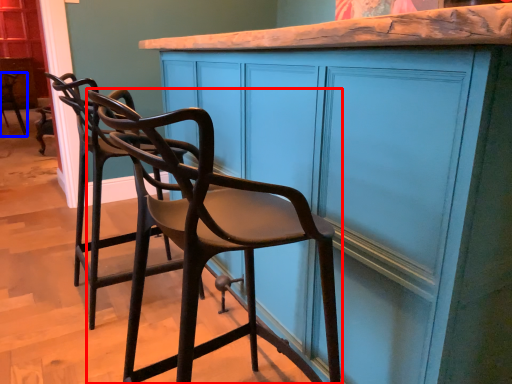
Question: Which object appears farthest to the camera in this image, chair (highlighted by a red box) or chair (highlighted by a blue box)?

Choices:
 (A) chair
 (B) chair

Answer: (B)